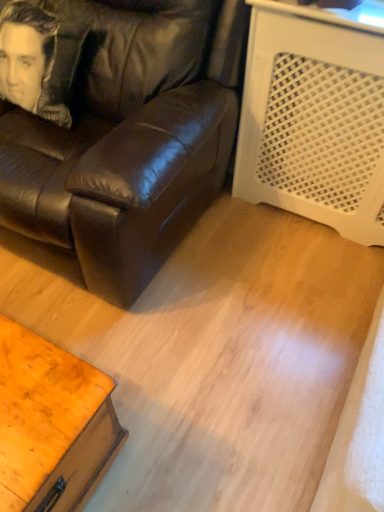
Question: Is matte black leather couch at center completely or partially inside wooden table at lower left?

Choices:
 (A) no
 (B) yes

Answer: (A)

Question: Considering the relative sizes of wooden table at lower left and matte black leather couch at center in the image provided, is wooden table at lower left thinner than matte black leather couch at center?

Choices:
 (A) yes
 (B) no

Answer: (A)

Question: Is wooden table at lower left bigger than matte black leather couch at center?

Choices:
 (A) yes
 (B) no

Answer: (B)

Question: Is wooden table at lower left shorter than matte black leather couch at center?

Choices:
 (A) no
 (B) yes

Answer: (B)

Question: From the image's perspective, is wooden table at lower left above matte black leather couch at center?

Choices:
 (A) no
 (B) yes

Answer: (A)

Question: Is the depth of wooden table at lower left greater than that of matte black leather couch at center?

Choices:
 (A) yes
 (B) no

Answer: (B)

Question: Can you confirm if matte black leather couch at center is wider than wooden table at lower left?

Choices:
 (A) yes
 (B) no

Answer: (A)

Question: Is matte black leather couch at center bigger than wooden table at lower left?

Choices:
 (A) yes
 (B) no

Answer: (A)

Question: From a real-world perspective, is matte black leather couch at center physically above wooden table at lower left?

Choices:
 (A) yes
 (B) no

Answer: (A)

Question: Can you confirm if matte black leather couch at center is shorter than wooden table at lower left?

Choices:
 (A) yes
 (B) no

Answer: (B)

Question: Would you say matte black leather couch at center is outside wooden table at lower left?

Choices:
 (A) yes
 (B) no

Answer: (A)

Question: From a real-world perspective, is matte black leather couch at center physically below wooden table at lower left?

Choices:
 (A) no
 (B) yes

Answer: (A)

Question: Is smooth leather pillow at upper left at the right side of wooden table at lower left?

Choices:
 (A) yes
 (B) no

Answer: (B)